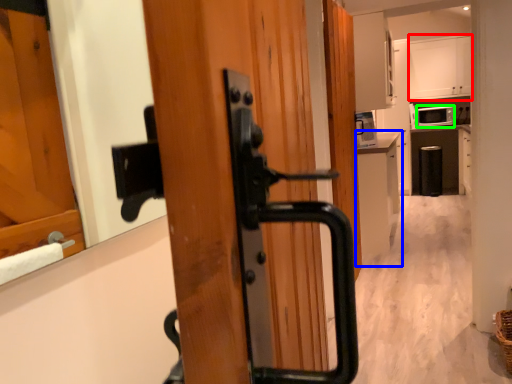
Question: Which object is the farthest from cabinetry (highlighted by a red box)? Choose among these: cabinetry (highlighted by a blue box) or appliance (highlighted by a green box).

Choices:
 (A) cabinetry
 (B) appliance

Answer: (A)